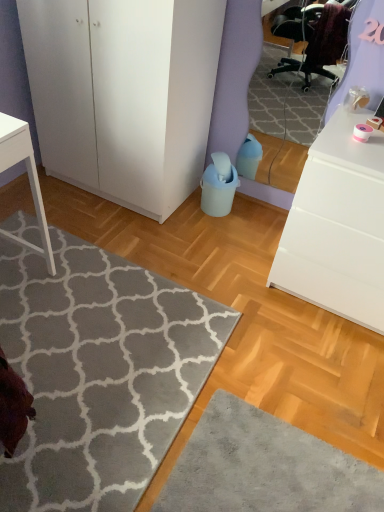
Question: In the image, is white matte chest of drawers at right on the left side or the right side of white matte cabinet at left?

Choices:
 (A) left
 (B) right

Answer: (B)

Question: Considering the positions of white matte chest of drawers at right and white matte cabinet at left in the image, is white matte chest of drawers at right wider or thinner than white matte cabinet at left?

Choices:
 (A) thin
 (B) wide

Answer: (A)

Question: Which object is positioned closest to the white matte cabinet at left?

Choices:
 (A) white matte chest of drawers at right
 (B) gray soft rug at lower left

Answer: (B)

Question: Estimate the real-world distances between objects in this image. Which object is closer to the white matte cabinet at left?

Choices:
 (A) white matte chest of drawers at right
 (B) gray soft rug at lower left

Answer: (B)